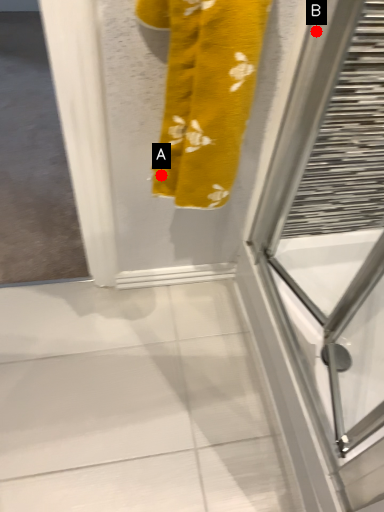
Question: Two points are circled on the image, labeled by A and B beside each circle. Which point is further to the camera?

Choices:
 (A) A is further
 (B) B is further

Answer: (A)